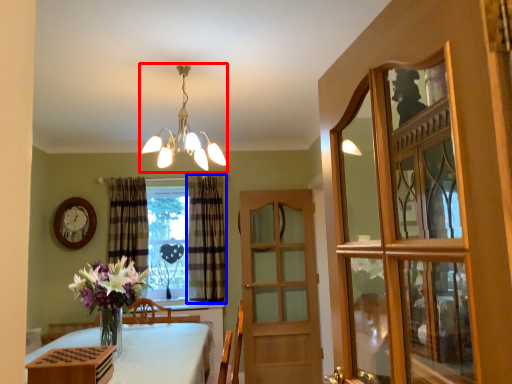
Question: Which point is closer to the camera, lamp (highlighted by a red box) or curtain (highlighted by a blue box)?

Choices:
 (A) lamp
 (B) curtain

Answer: (A)